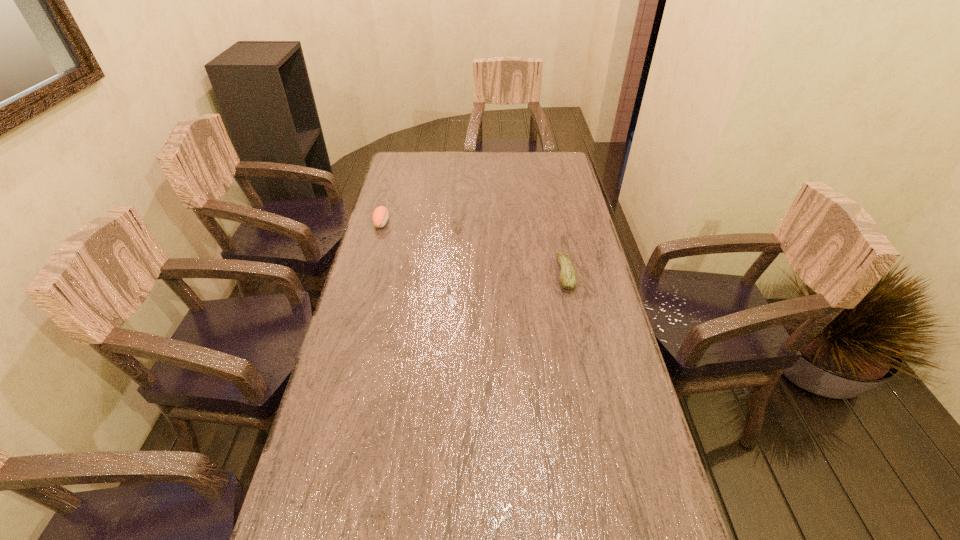
At what (x,y) coordinates should I click in order to perform the action: click on free location at the far edge. Please return your answer as a coordinate pair (x, y). Looking at the image, I should click on (458, 178).

What are the coordinates of `vacant space at the left edge` in the screenshot? It's located at (393, 216).

You are a GUI agent. You are given a task and a screenshot of the screen. Output one action in this format:
    pyautogui.click(x=<x>, y=<y>)
    Task: Click on the vacant space at the right edge of the desktop
    This screenshot has width=960, height=540.
    Given the screenshot: What is the action you would take?
    pyautogui.click(x=551, y=194)

This screenshot has height=540, width=960. In order to click on vacant area between the rightmost object and the farther sushi in this screenshot , I will do `click(473, 248)`.

Locate an element on the screen. vacant area between the second farthest object and the leftmost object is located at coordinates (473, 248).

Identify which object is the second closest to the leftmost object. Please provide its 2D coordinates. Your answer should be formatted as a tuple, i.e. [(x, y)], where the tuple contains the x and y coordinates of a point satisfying the conditions above.

[(548, 539)]

Locate which object ranks in proximity to the farthest object. Please provide its 2D coordinates. Your answer should be formatted as a tuple, i.e. [(x, y)], where the tuple contains the x and y coordinates of a point satisfying the conditions above.

[(568, 279)]